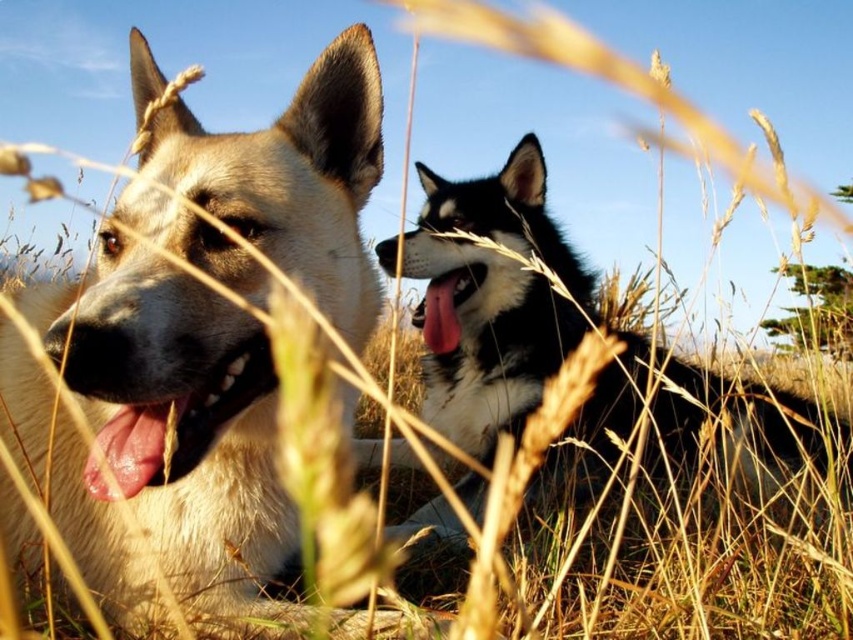
Question: Is golden fur dog at left further to camera compared to pink glossy tongue at center?

Choices:
 (A) yes
 (B) no

Answer: (B)

Question: Based on their relative distances, which object is farther from the golden fur dog at left?

Choices:
 (A) pink glossy tongue at center
 (B) black and white fur at center

Answer: (A)

Question: Among these points, which one is nearest to the camera?

Choices:
 (A) (450, 282)
 (B) (698, 388)

Answer: (B)

Question: Does golden fur dog at left lie behind pink glossy tongue at center?

Choices:
 (A) no
 (B) yes

Answer: (A)

Question: Is golden fur dog at left positioned at the back of black and white fur at center?

Choices:
 (A) no
 (B) yes

Answer: (A)

Question: Which point is farther from the camera taking this photo?

Choices:
 (A) (546, 320)
 (B) (466, 268)
 (C) (90, 472)

Answer: (A)